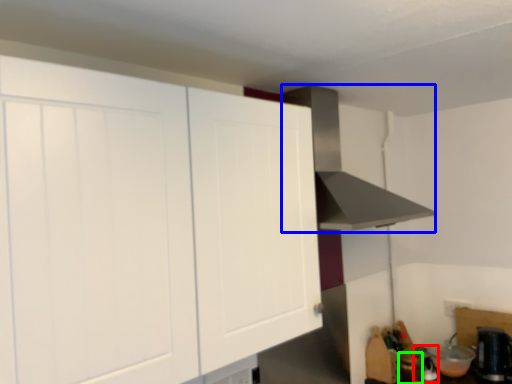
Question: Considering the real-world distances, which object is farthest from appliance (highlighted by a red box)? vent (highlighted by a blue box) or appliance (highlighted by a green box)?

Choices:
 (A) vent
 (B) appliance

Answer: (A)